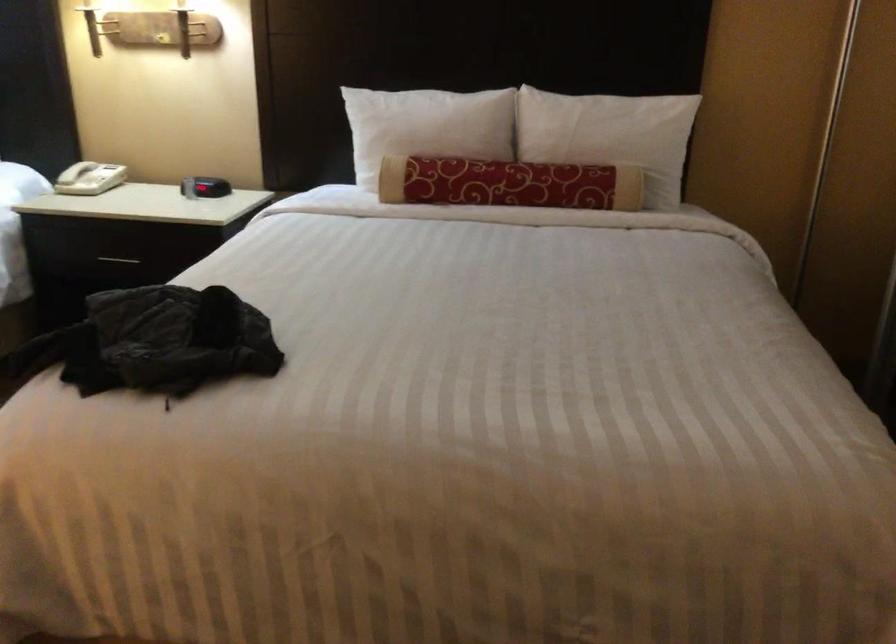
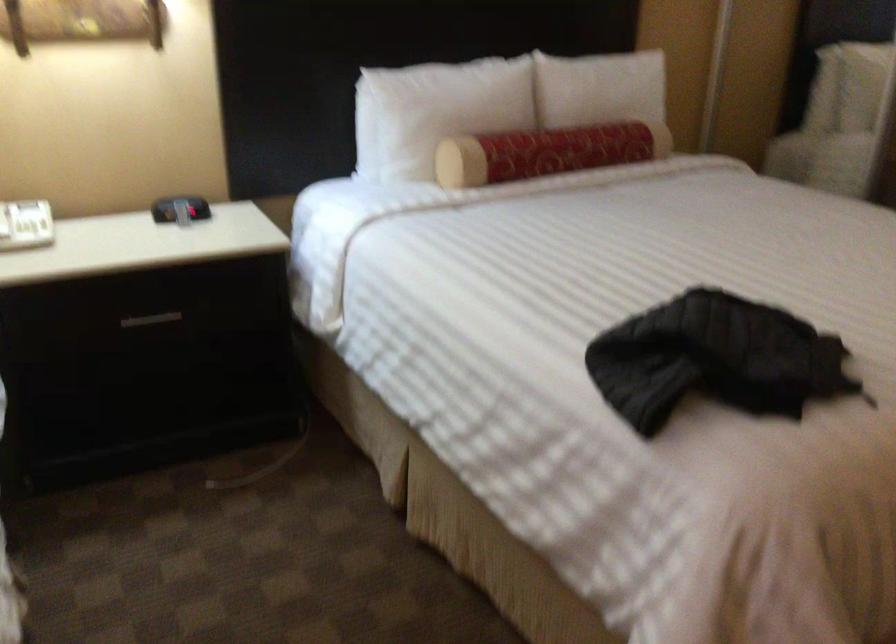
In the second image, find the point that corresponds to point 115,254 in the first image.

(151, 319)